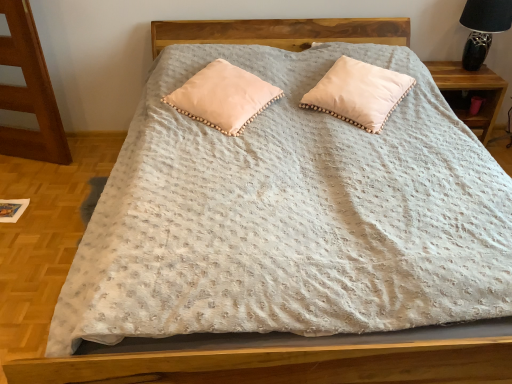
Question: From the image's perspective, is peachy soft pillow at center, the first pillow positioned from the left, located beneath black ceramic table lamp at upper right?

Choices:
 (A) no
 (B) yes

Answer: (B)

Question: Considering the relative positions of peachy soft pillow at center, arranged as the 2th pillow when viewed from the right, and black ceramic table lamp at upper right in the image provided, is peachy soft pillow at center, arranged as the 2th pillow when viewed from the right, to the left of black ceramic table lamp at upper right from the viewer's perspective?

Choices:
 (A) yes
 (B) no

Answer: (A)

Question: From a real-world perspective, is peachy soft pillow at center, the first pillow positioned from the left, on black ceramic table lamp at upper right?

Choices:
 (A) no
 (B) yes

Answer: (A)

Question: Is peachy soft pillow at center, the first pillow positioned from the left, bigger than black ceramic table lamp at upper right?

Choices:
 (A) yes
 (B) no

Answer: (B)

Question: Is peachy soft pillow at center, arranged as the 2th pillow when viewed from the right, positioned behind black ceramic table lamp at upper right?

Choices:
 (A) yes
 (B) no

Answer: (B)

Question: Is peachy soft pillow at upper center, the 2th pillow in the left-to-right sequence, in front of or behind wooden nightstand at right in the image?

Choices:
 (A) behind
 (B) front

Answer: (B)

Question: Which is correct: peachy soft pillow at upper center, the 2th pillow in the left-to-right sequence, is inside wooden nightstand at right, or outside of it?

Choices:
 (A) inside
 (B) outside

Answer: (B)

Question: Is peachy soft pillow at upper center, the 2th pillow in the left-to-right sequence, bigger or smaller than wooden nightstand at right?

Choices:
 (A) big
 (B) small

Answer: (B)

Question: From the image's perspective, is peachy soft pillow at upper center, arranged as the first pillow when viewed from the right, positioned above or below wooden nightstand at right?

Choices:
 (A) above
 (B) below

Answer: (B)

Question: Considering the positions of peachy soft pillow at center, arranged as the 2th pillow when viewed from the right, and wooden nightstand at right in the image, is peachy soft pillow at center, arranged as the 2th pillow when viewed from the right, taller or shorter than wooden nightstand at right?

Choices:
 (A) short
 (B) tall

Answer: (A)

Question: Based on their sizes in the image, would you say peachy soft pillow at center, the first pillow positioned from the left, is bigger or smaller than wooden nightstand at right?

Choices:
 (A) big
 (B) small

Answer: (B)

Question: Is peachy soft pillow at center, the first pillow positioned from the left, inside the boundaries of wooden nightstand at right, or outside?

Choices:
 (A) inside
 (B) outside

Answer: (B)

Question: From the image's perspective, is peachy soft pillow at center, arranged as the 2th pillow when viewed from the right, above or below wooden nightstand at right?

Choices:
 (A) above
 (B) below

Answer: (B)

Question: Is wooden nightstand at right wider or thinner than black ceramic table lamp at upper right?

Choices:
 (A) thin
 (B) wide

Answer: (B)

Question: Does point (468, 77) appear closer or farther from the camera than point (484, 34)?

Choices:
 (A) closer
 (B) farther

Answer: (B)